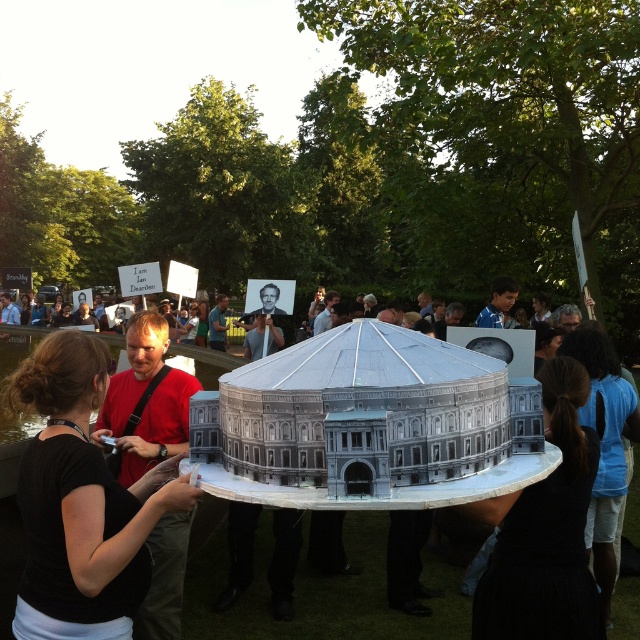
You are standing in the outdoor scene and see the point at coordinates (81,500). What object is located at that point?

The point at coordinates (81,500) corresponds to the black matte shirt at center.

You are a photographer trying to capture a clear photo of the matte gray building at center and the black fabric ponytail at lower right. Which object should you focus on first to ensure it appears sharp in the photo?

The matte gray building at center is much taller than the black fabric ponytail at lower right, so you should focus on the matte gray building at center first to ensure it appears sharp in the photo.